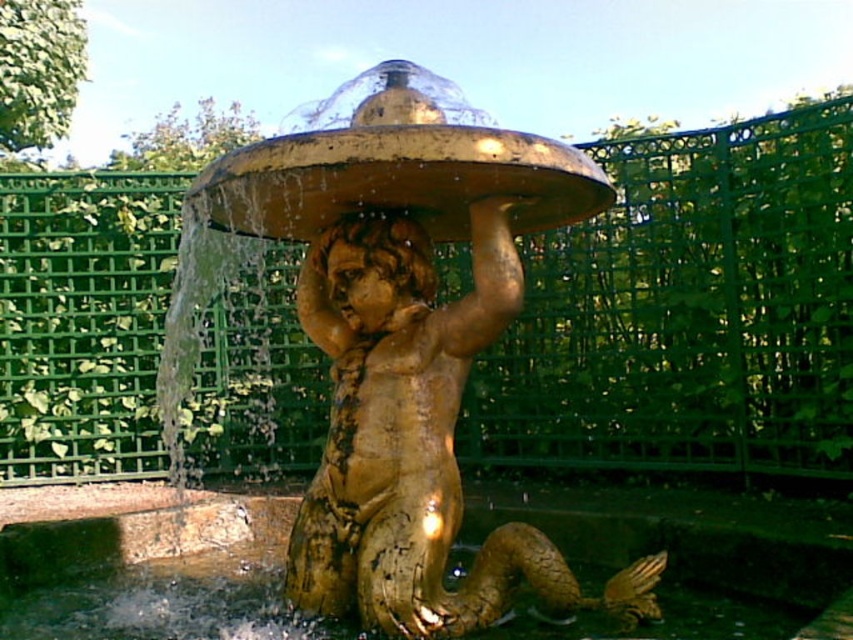
Question: Estimate the real-world distances between objects in this image. Which object is farther from the gold metallic water at center?

Choices:
 (A) gold textured cherub at center
 (B) golden polished statue head at center

Answer: (B)

Question: Is gold textured cherub at center positioned in front of golden polished statue head at center?

Choices:
 (A) yes
 (B) no

Answer: (A)

Question: Which of the following is the closest to the observer?

Choices:
 (A) (18, 525)
 (B) (360, 176)

Answer: (B)

Question: Does gold textured cherub at center appear under golden polished statue head at center?

Choices:
 (A) no
 (B) yes

Answer: (B)

Question: Is gold textured cherub at center wider than gold metallic water at center?

Choices:
 (A) yes
 (B) no

Answer: (A)

Question: Which of the following is the farthest from the observer?

Choices:
 (A) (398, 560)
 (B) (196, 634)

Answer: (B)